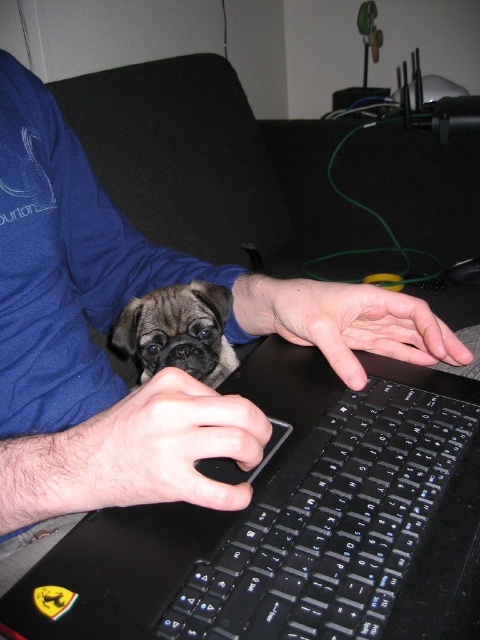
Question: Is black plastic keyboard at lower center above smooth skin hand at center?

Choices:
 (A) yes
 (B) no

Answer: (B)

Question: Among these objects, which one is nearest to the camera?

Choices:
 (A) fuzzy brown dog at center
 (B) black matte mouse at center

Answer: (B)

Question: Does black matte mouse at center appear on the left side of fuzzy brown dog at center?

Choices:
 (A) no
 (B) yes

Answer: (A)

Question: Does black matte mouse at center appear under smooth skin hand at center?

Choices:
 (A) yes
 (B) no

Answer: (A)

Question: Which object appears farthest from the camera in this image?

Choices:
 (A) black matte mouse at center
 (B) fuzzy brown dog at center
 (C) smooth skin hand at center
 (D) black plastic keyboard at lower center

Answer: (B)

Question: Based on their relative distances, which object is nearer to the fuzzy brown dog at center?

Choices:
 (A) smooth skin hand at center
 (B) black matte mouse at center
 (C) black plastic keyboard at lower center

Answer: (A)